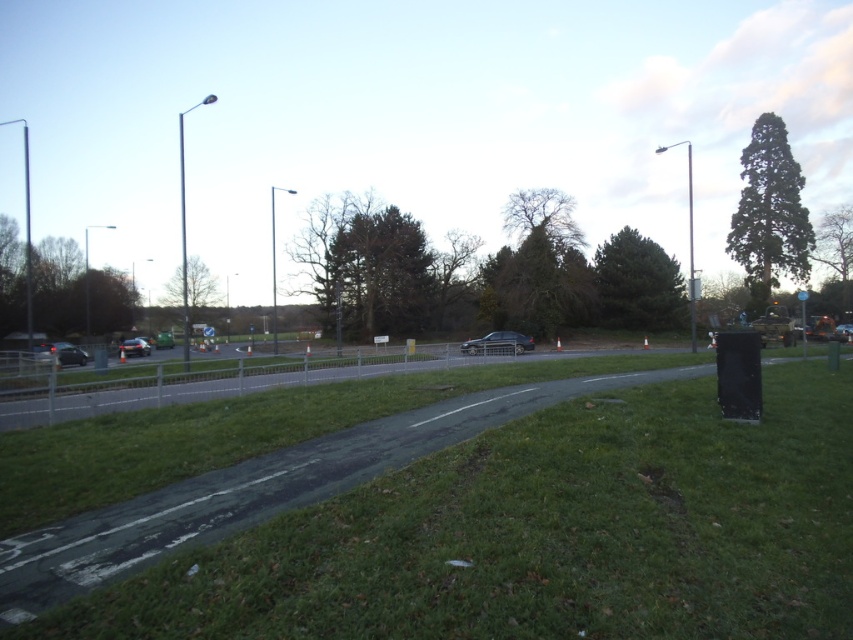
Who is more distant from viewer, (502,336) or (126,355)?

The point (126,355) is more distant.

Between point (502, 342) and point (144, 340), which one is positioned in front?

Point (502, 342)

Between point (515, 349) and point (149, 352), which one is positioned behind?

The point (149, 352) is more distant.

This screenshot has width=853, height=640. Find the location of `satin silver sedan at center`. satin silver sedan at center is located at coordinates (x=498, y=342).

Does green grass at lower center lie in front of matte black car at lower left?

Yes, green grass at lower center is closer to the viewer.

Is green grass at lower center bigger than matte black car at lower left?

Incorrect, green grass at lower center is not larger than matte black car at lower left.

Between point (229, 544) and point (140, 340), which one is positioned behind?

The point (140, 340) is more distant.

Locate an element on the screen. green grass at lower center is located at coordinates (544, 536).

Who is lower down, green grass at lower center or shiny silver car at lower left?

green grass at lower center

Does green grass at lower center have a smaller size compared to shiny silver car at lower left?

Correct, green grass at lower center occupies less space than shiny silver car at lower left.

Does point (606, 406) come closer to viewer compared to point (55, 352)?

That is True.

Where is `green grass at lower center`? This screenshot has width=853, height=640. green grass at lower center is located at coordinates (544, 536).